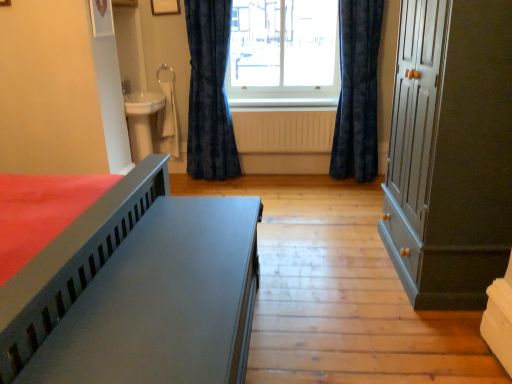
What is the approximate height of white wood at center?

white wood at center is 1.73 inches tall.

The height and width of the screenshot is (384, 512). What do you see at coordinates (284, 131) in the screenshot? I see `yellow matte radiator at center` at bounding box center [284, 131].

Describe the element at coordinates (209, 92) in the screenshot. I see `velvet dark blue curtain at center, which is counted as the first curtain, starting from the left` at that location.

Find the location of `matte gray cupboard at right`. matte gray cupboard at right is located at coordinates (450, 152).

Where is `transparent glass window at center`? The width and height of the screenshot is (512, 384). transparent glass window at center is located at coordinates (283, 49).

The height and width of the screenshot is (384, 512). Describe the element at coordinates (283, 49) in the screenshot. I see `transparent glass window at center` at that location.

This screenshot has width=512, height=384. What do you see at coordinates (137, 291) in the screenshot?
I see `matte gray bed at lower left` at bounding box center [137, 291].

At what (x,y) coordinates should I click in order to perform the action: click on white wood at center. Please return your answer as a coordinate pair (x, y). Looking at the image, I should click on (282, 103).

Can you confirm if velvet dark blue curtain at center, which is the 2th curtain in right-to-left order, is wider than matte gray bed at lower left?

In fact, velvet dark blue curtain at center, which is the 2th curtain in right-to-left order, might be narrower than matte gray bed at lower left.

Between velvet dark blue curtain at center, which is counted as the first curtain, starting from the left, and matte gray bed at lower left, which one appears on the left side from the viewer's perspective?

Positioned to the left is velvet dark blue curtain at center, which is counted as the first curtain, starting from the left.

Does point (207, 102) appear closer or farther from the camera than point (160, 359)?

Point (207, 102).

Between transparent glass window at center and matte gray cupboard at right, which one has smaller size?

Smaller between the two is transparent glass window at center.

Is transparent glass window at center taller than matte gray cupboard at right?

Incorrect, the height of transparent glass window at center is not larger of that of matte gray cupboard at right.

Considering the positions of objects transparent glass window at center and matte gray cupboard at right in the image provided, who is in front, transparent glass window at center or matte gray cupboard at right?

matte gray cupboard at right is closer to the camera.

You are a GUI agent. You are given a task and a screenshot of the screen. Output one action in this format:
    pyautogui.click(x=<x>, y=<y>)
    Task: Click on the radiator lying behind the matte gray bed at lower left
    This screenshot has width=512, height=384.
    Given the screenshot: What is the action you would take?
    pyautogui.click(x=284, y=131)

Considering the sizes of objects matte gray bed at lower left and yellow matte radiator at center in the image provided, who is wider, matte gray bed at lower left or yellow matte radiator at center?

Wider between the two is matte gray bed at lower left.

Which point is more forward, (172, 237) or (261, 115)?

The point (172, 237) is closer to the camera.

Consider the image. Is matte gray bed at lower left facing towards yellow matte radiator at center?

No, matte gray bed at lower left is not oriented towards yellow matte radiator at center.

Is matte gray cupboard at right taller or shorter than matte gray bed at lower left?

Clearly, matte gray cupboard at right is taller compared to matte gray bed at lower left.

Looking at this image, is matte gray cupboard at right oriented away from matte gray bed at lower left?

matte gray cupboard at right is not turned away from matte gray bed at lower left.

Where is `cupboard located behind the matte gray bed at lower left`? This screenshot has width=512, height=384. cupboard located behind the matte gray bed at lower left is located at coordinates (450, 152).

This screenshot has width=512, height=384. What are the coordinates of `the 2nd curtain in front of the yellow matte radiator at center, counting from the anchor's position` in the screenshot? It's located at (357, 91).

From a real-world perspective, does yellow matte radiator at center sit lower than velvet dark blue curtain at center, the 2th curtain when ordered from left to right?

Indeed, from a real-world perspective, yellow matte radiator at center is positioned beneath velvet dark blue curtain at center, the 2th curtain when ordered from left to right.

Considering the points (293, 135) and (348, 144), which point is in front, point (293, 135) or point (348, 144)?

The point (348, 144) is closer to the camera.

Would you say white wood at center is outside velvet dark blue curtain at center, positioned as the 1th curtain in right-to-left order?

Yes, white wood at center is located beyond the bounds of velvet dark blue curtain at center, positioned as the 1th curtain in right-to-left order.

Looking at this image, between white wood at center and velvet dark blue curtain at center, positioned as the 1th curtain in right-to-left order, which one has larger width?

With larger width is velvet dark blue curtain at center, positioned as the 1th curtain in right-to-left order.

Which is more distant, (247,108) or (354,173)?

The point (247,108) is behind.

Considering the sizes of objects matte gray cupboard at right and transparent glass window at center in the image provided, who is taller, matte gray cupboard at right or transparent glass window at center?

With more height is matte gray cupboard at right.

Is there a large distance between matte gray cupboard at right and transparent glass window at center?

Absolutely, matte gray cupboard at right is distant from transparent glass window at center.

Is matte gray cupboard at right wider or thinner than transparent glass window at center?

In the image, matte gray cupboard at right appears to be wider than transparent glass window at center.

Does matte gray cupboard at right turn towards transparent glass window at center?

No, matte gray cupboard at right is not turned towards transparent glass window at center.

Find the location of a particular element. The width and height of the screenshot is (512, 384). curtain on the left of matte gray bed at lower left is located at coordinates (209, 92).

You are a GUI agent. You are given a task and a screenshot of the screen. Output one action in this format:
    pyautogui.click(x=<x>, y=<y>)
    Task: Click on the cupboard that is below the transparent glass window at center (from the image's perspective)
    This screenshot has height=384, width=512.
    Given the screenshot: What is the action you would take?
    pyautogui.click(x=450, y=152)

Considering their positions, is velvet dark blue curtain at center, the 2th curtain when ordered from left to right, positioned closer to transparent glass window at center than white wood at center?

Based on the image, white wood at center appears to be nearer to transparent glass window at center.

Estimate the real-world distances between objects in this image. Which object is further from velvet dark blue curtain at center, which is the 2th curtain in right-to-left order, matte gray cupboard at right or velvet dark blue curtain at center, the 2th curtain when ordered from left to right?

matte gray cupboard at right.

Which object lies further to the anchor point velvet dark blue curtain at center, the 2th curtain when ordered from left to right, velvet dark blue curtain at center, which is the 2th curtain in right-to-left order, or matte gray bed at lower left?

Based on the image, matte gray bed at lower left appears to be further to velvet dark blue curtain at center, the 2th curtain when ordered from left to right.

From the picture: Looking at the image, which one is located further to transparent glass window at center, white wood at center or matte gray cupboard at right?

matte gray cupboard at right is further to transparent glass window at center.

Based on their spatial positions, is velvet dark blue curtain at center, positioned as the 1th curtain in right-to-left order, or transparent glass window at center further from velvet dark blue curtain at center, which is counted as the first curtain, starting from the left?

velvet dark blue curtain at center, positioned as the 1th curtain in right-to-left order, is further to velvet dark blue curtain at center, which is counted as the first curtain, starting from the left.

Looking at the image, which one is located closer to velvet dark blue curtain at center, positioned as the 1th curtain in right-to-left order, matte gray cupboard at right or yellow matte radiator at center?

yellow matte radiator at center is closer to velvet dark blue curtain at center, positioned as the 1th curtain in right-to-left order.

Considering their positions, is velvet dark blue curtain at center, which is the 2th curtain in right-to-left order, positioned further to transparent glass window at center than yellow matte radiator at center?

The object further to transparent glass window at center is yellow matte radiator at center.

From the image, which object appears to be nearer to velvet dark blue curtain at center, positioned as the 1th curtain in right-to-left order, matte gray bed at lower left or yellow matte radiator at center?

yellow matte radiator at center lies closer to velvet dark blue curtain at center, positioned as the 1th curtain in right-to-left order, than the other object.

Locate an element on the screen. The width and height of the screenshot is (512, 384). window located between matte gray bed at lower left and yellow matte radiator at center in the depth direction is located at coordinates (283, 49).

The height and width of the screenshot is (384, 512). I want to click on cupboard between matte gray bed at lower left and transparent glass window at center in the front-back direction, so click(450, 152).

Identify the location of window sill between transparent glass window at center and yellow matte radiator at center in the vertical direction. The image size is (512, 384). (282, 103).

Identify the location of window located between velvet dark blue curtain at center, which is the 2th curtain in right-to-left order, and yellow matte radiator at center in the left-right direction. (283, 49).